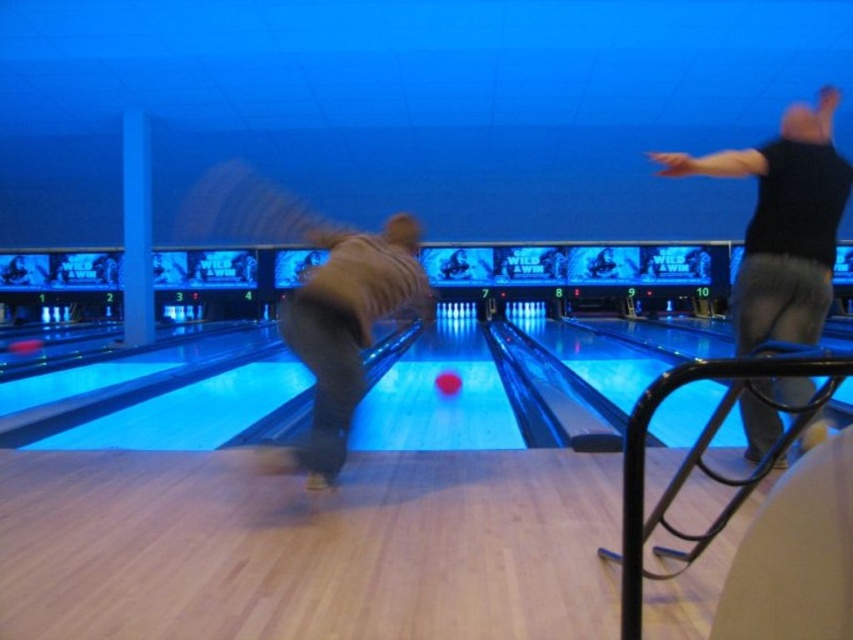
Which is more to the left, black matte shirt at upper right or brown suede jacket at center?

Positioned to the left is brown suede jacket at center.

Measure the distance from black matte shirt at upper right to brown suede jacket at center.

The distance of black matte shirt at upper right from brown suede jacket at center is 5.06 feet.

Who is more distant from viewer, (822, 221) or (286, 298)?

Point (286, 298)

This screenshot has height=640, width=853. Identify the location of black matte shirt at upper right. (782, 224).

Can you confirm if brown suede jacket at center is positioned above shiny red bowling ball at center?

Correct, brown suede jacket at center is located above shiny red bowling ball at center.

You are a GUI agent. You are given a task and a screenshot of the screen. Output one action in this format:
    pyautogui.click(x=<x>, y=<y>)
    Task: Click on the brown suede jacket at center
    The image size is (853, 640).
    Given the screenshot: What is the action you would take?
    pyautogui.click(x=345, y=332)

The image size is (853, 640). Find the location of `brown suede jacket at center`. brown suede jacket at center is located at coordinates (345, 332).

Is black matte shirt at upper right wider than shiny red bowling ball at center?

Yes, black matte shirt at upper right is wider than shiny red bowling ball at center.

You are a GUI agent. You are given a task and a screenshot of the screen. Output one action in this format:
    pyautogui.click(x=<x>, y=<y>)
    Task: Click on the black matte shirt at upper right
    The image size is (853, 640).
    Given the screenshot: What is the action you would take?
    pyautogui.click(x=782, y=224)